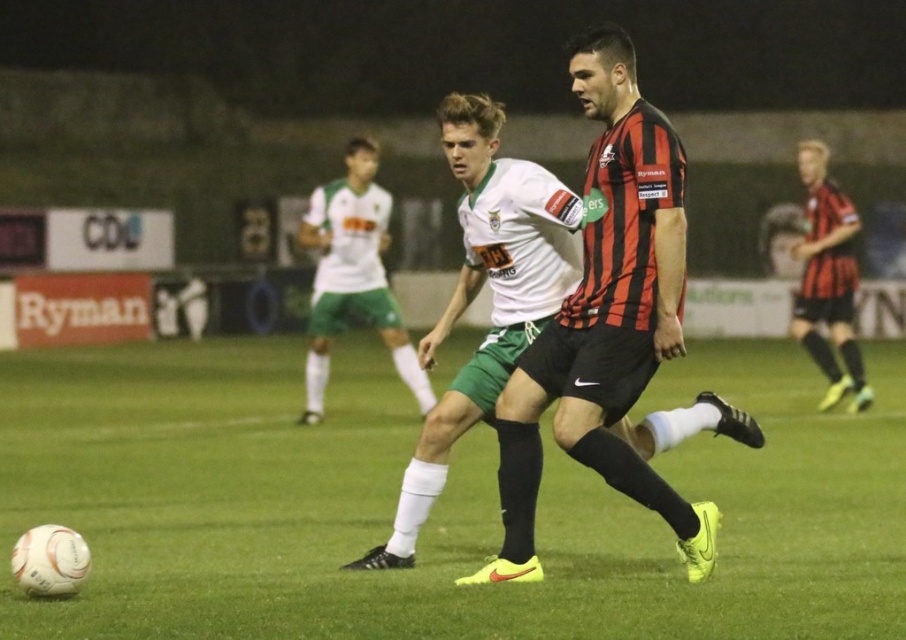
Can you confirm if white synthetic football at center is smaller than matte black jersey at center?

No, white synthetic football at center is not smaller than matte black jersey at center.

Can you confirm if white synthetic football at center is wider than matte black jersey at center?

Yes.

Does point (333, 483) lie in front of point (538, 442)?

No, it is not.

You are a GUI agent. You are given a task and a screenshot of the screen. Output one action in this format:
    pyautogui.click(x=<x>, y=<y>)
    Task: Click on the white synthetic football at center
    
    Given the screenshot: What is the action you would take?
    pyautogui.click(x=432, y=506)

Does white synthetic football at center come in front of white matte jersey at center?

Yes, it is in front of white matte jersey at center.

Does white synthetic football at center appear under white matte jersey at center?

Yes.

Locate an element on the screen. white synthetic football at center is located at coordinates point(432,506).

Find the location of a particular element. Image resolution: width=906 pixels, height=640 pixels. white synthetic football at center is located at coordinates click(432, 506).

Does white synthetic football at center have a lesser height compared to matte black shorts at right?

Incorrect, white synthetic football at center's height does not fall short of matte black shorts at right's.

The width and height of the screenshot is (906, 640). Describe the element at coordinates (432, 506) in the screenshot. I see `white synthetic football at center` at that location.

Is point (477, 548) behind point (834, 259)?

No, it is in front of (834, 259).

The width and height of the screenshot is (906, 640). In order to click on white synthetic football at center in this screenshot , I will do `click(432, 506)`.